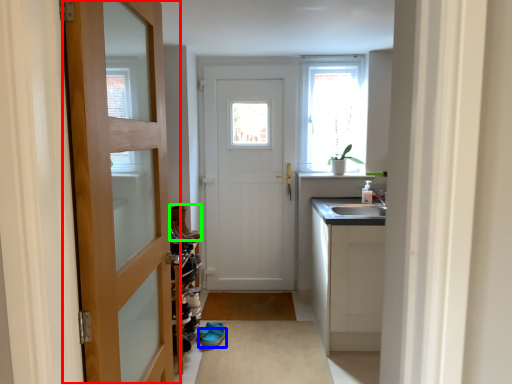
Question: Which object is the closest to the door (highlighted by a red box)? Choose among these: footwear (highlighted by a blue box) or shoe (highlighted by a green box).

Choices:
 (A) footwear
 (B) shoe

Answer: (B)